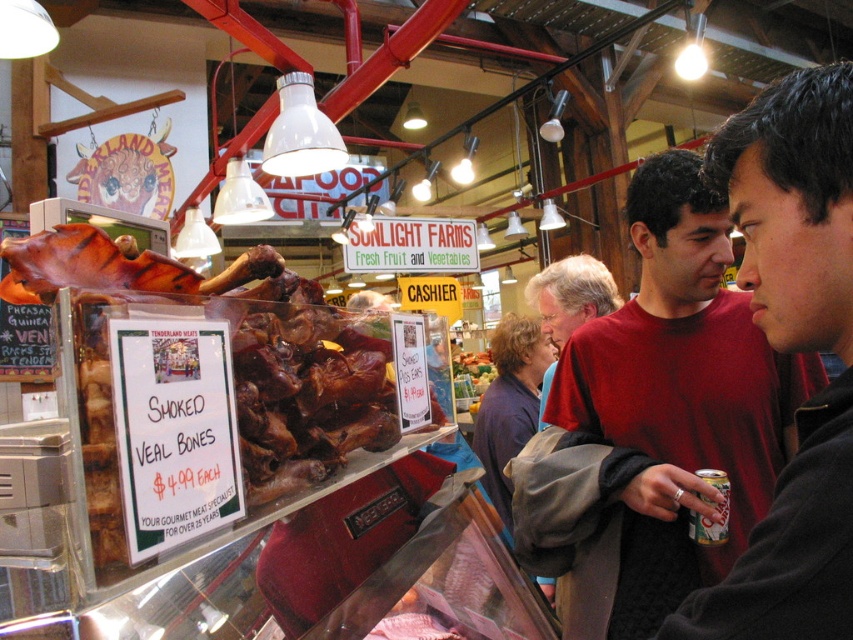
You are a customer in the market and you want to see both the dark blue sweater at center and the matte red shirt at center. Which one is easier to see from your current position?

The dark blue sweater at center is much taller than the matte red shirt at center, so it is easier to see from your current position.

You are a customer trying to choose between the red cotton shirt at center and the matte red shirt at center. The store has a limited shelf space, and you want to know which shirt takes up more space horizontally. Which one should you consider if you prefer a wider option?

The red cotton shirt at center has a larger width than the matte red shirt at center, so it takes up more horizontal space. If you prefer a wider option, choose the red cotton shirt at center.